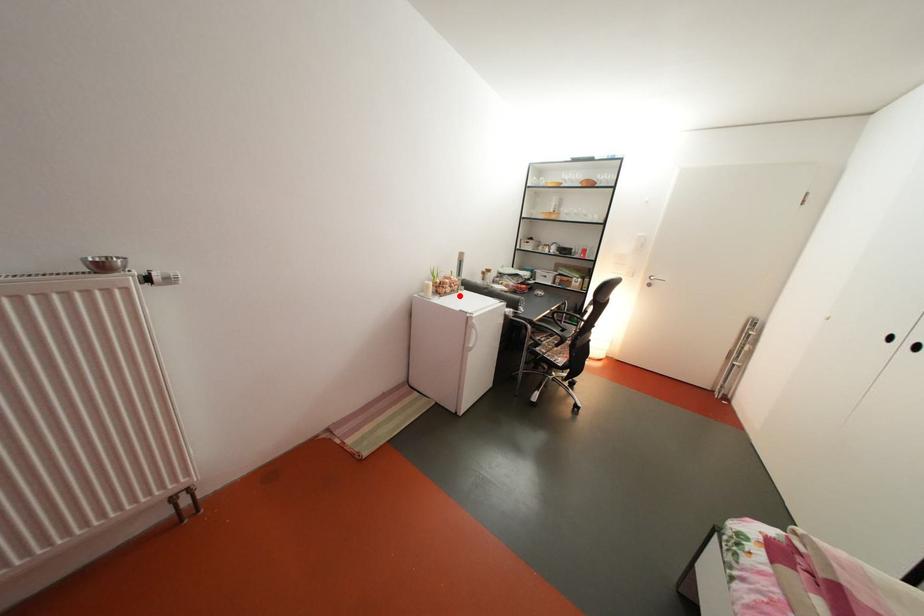
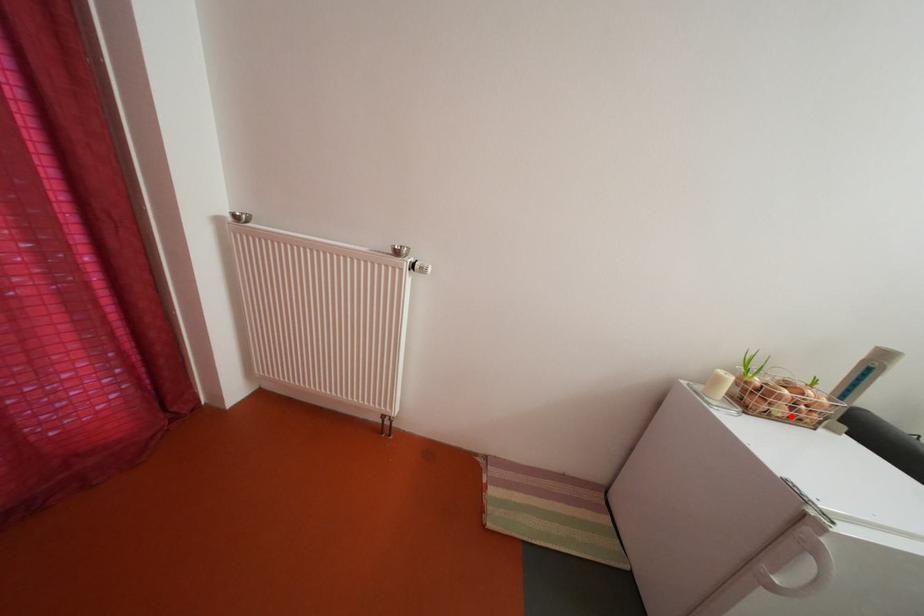
I am providing you with two images of the same scene from different viewpoints. A red point is marked on the first image and another point is marked on the second image. Is the marked point in image1 the same physical position as the marked point in image2?

Yes